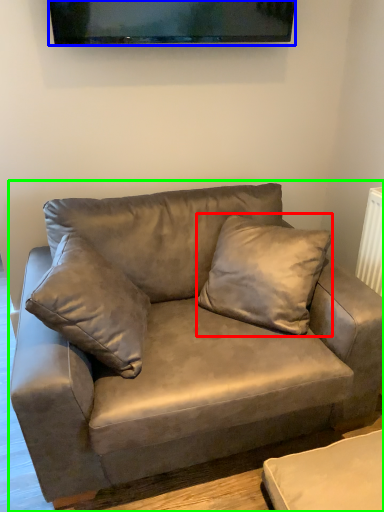
Question: Which object is the closest to the pillow (highlighted by a red box)? Choose among these: television (highlighted by a blue box) or studio couch (highlighted by a green box).

Choices:
 (A) television
 (B) studio couch

Answer: (B)